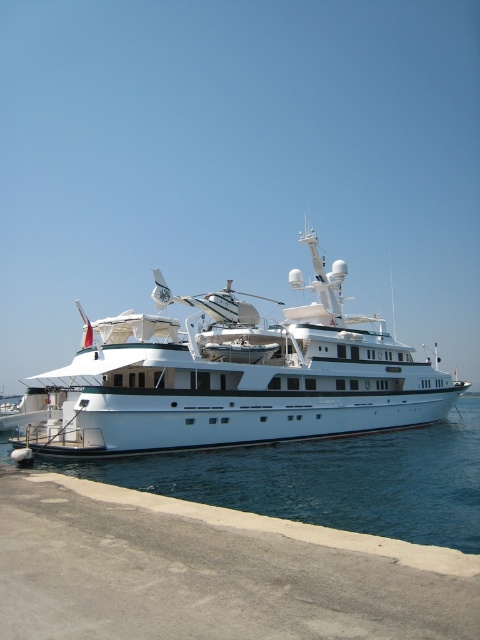
Question: Which point appears closest to the camera in this image?

Choices:
 (A) (348, 355)
 (B) (418, 472)

Answer: (B)

Question: Which object is closer to the camera taking this photo?

Choices:
 (A) white glossy yacht at center
 (B) clear blue water at lower center

Answer: (B)

Question: Does white glossy yacht at center appear on the left side of clear blue water at lower center?

Choices:
 (A) no
 (B) yes

Answer: (A)

Question: Among these objects, which one is nearest to the camera?

Choices:
 (A) white glossy yacht at center
 (B) clear blue water at lower center

Answer: (B)

Question: Does white glossy yacht at center appear over clear blue water at lower center?

Choices:
 (A) no
 (B) yes

Answer: (B)

Question: Is the position of white glossy yacht at center less distant than that of clear blue water at lower center?

Choices:
 (A) no
 (B) yes

Answer: (A)